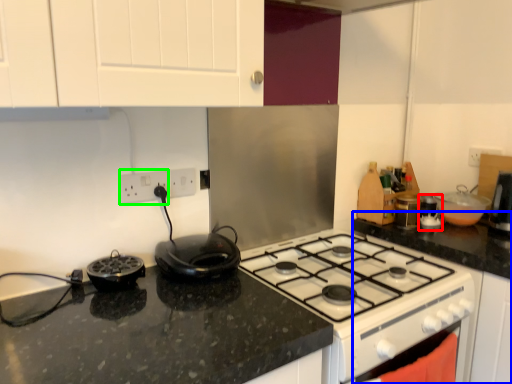
Question: Which object is the farthest from appliance (highlighted by a red box)? Choose among these: counter top (highlighted by a blue box) or electric outlet (highlighted by a green box).

Choices:
 (A) counter top
 (B) electric outlet

Answer: (B)